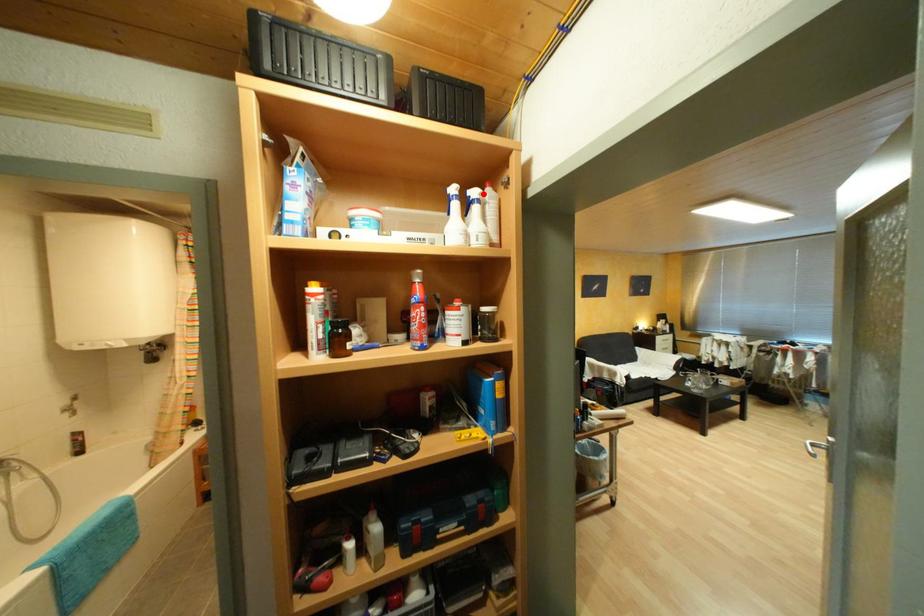
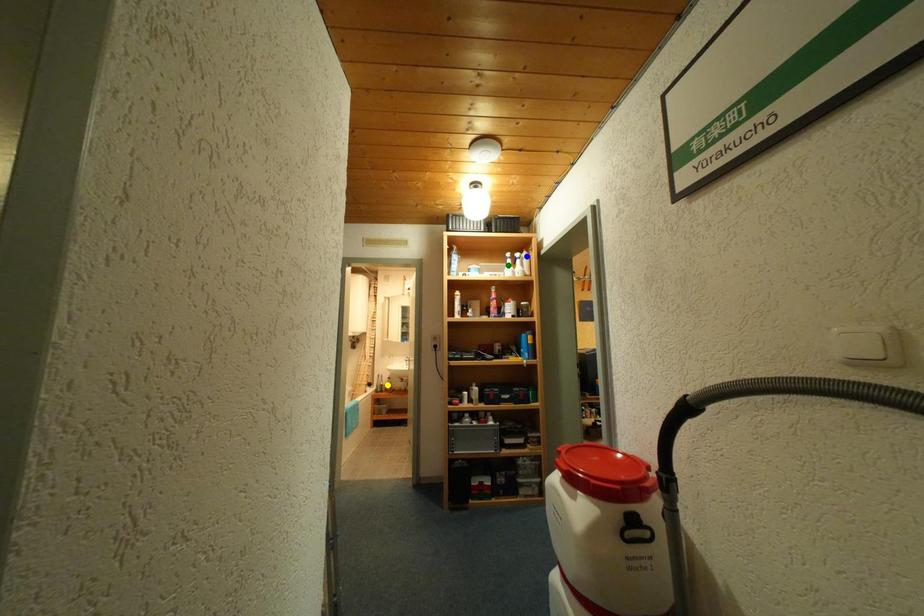
Question: I am providing you with two images of the same scene from different viewpoints. A red point is marked on the first image. You are given multiple points on the second image. Which point in image 2 is actually the same real-world point as the red point in image 1?

Choices:
 (A) yellow point
 (B) blue point
 (C) green point

Answer: (B)